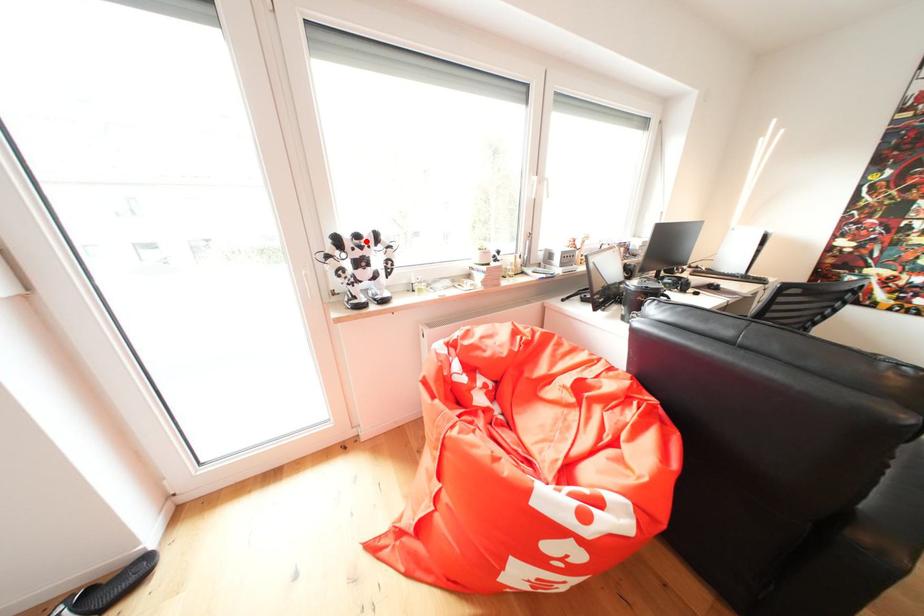
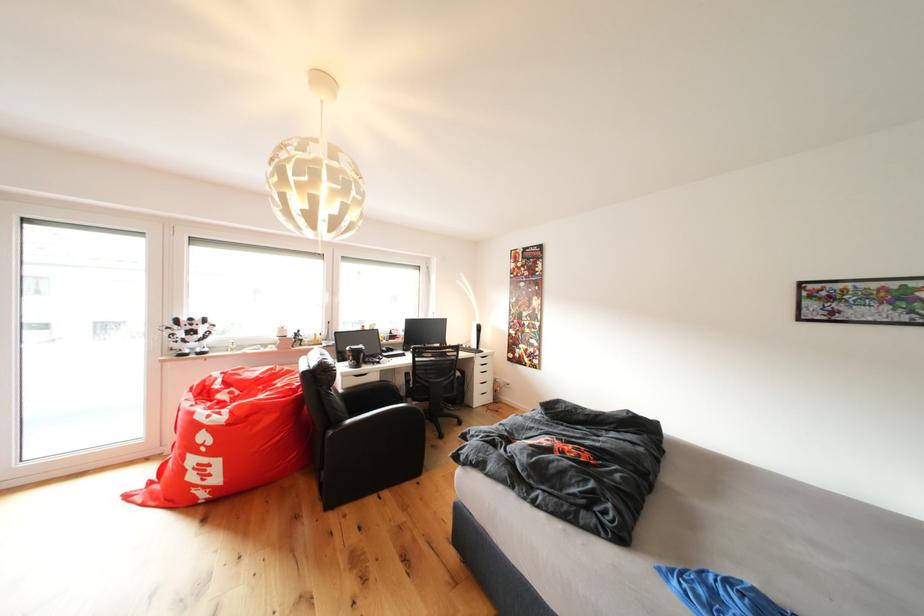
Locate, in the second image, the point that corresponds to the highlighted location in the first image.

(200, 323)